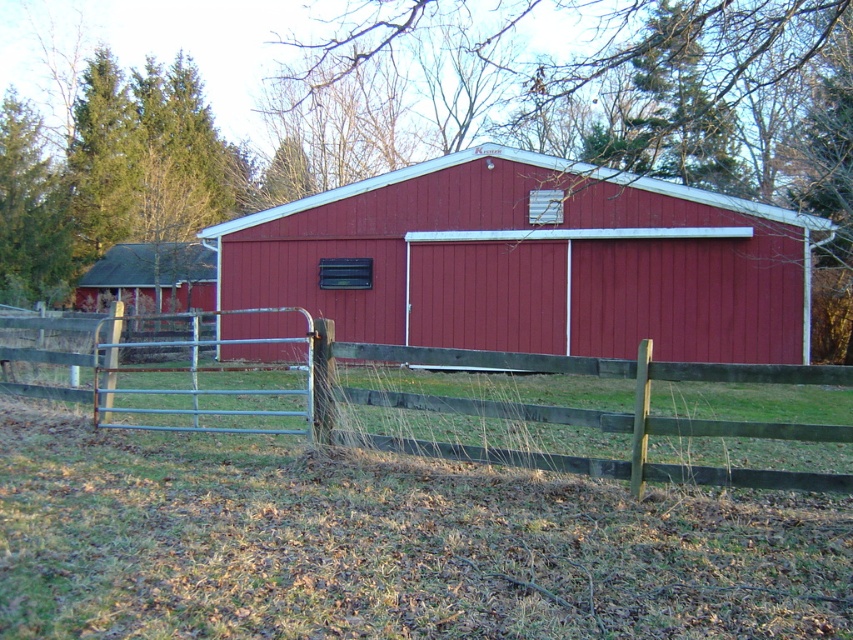
Question: Can you confirm if smooth red barn at center is positioned to the left of wooden fence at lower left?

Choices:
 (A) yes
 (B) no

Answer: (B)

Question: Considering the relative positions of smooth red barn at center and wooden fence at lower left in the image provided, where is smooth red barn at center located with respect to wooden fence at lower left?

Choices:
 (A) below
 (B) above

Answer: (B)

Question: Among these points, which one is nearest to the camera?

Choices:
 (A) (817, 372)
 (B) (660, 332)

Answer: (A)

Question: Among these points, which one is nearest to the camera?

Choices:
 (A) (368, 288)
 (B) (144, 320)

Answer: (A)

Question: Which of the following is the closest to the observer?

Choices:
 (A) (654, 426)
 (B) (305, 202)

Answer: (A)

Question: Can you confirm if smooth red barn at center is thinner than wooden fence at lower left?

Choices:
 (A) no
 (B) yes

Answer: (B)